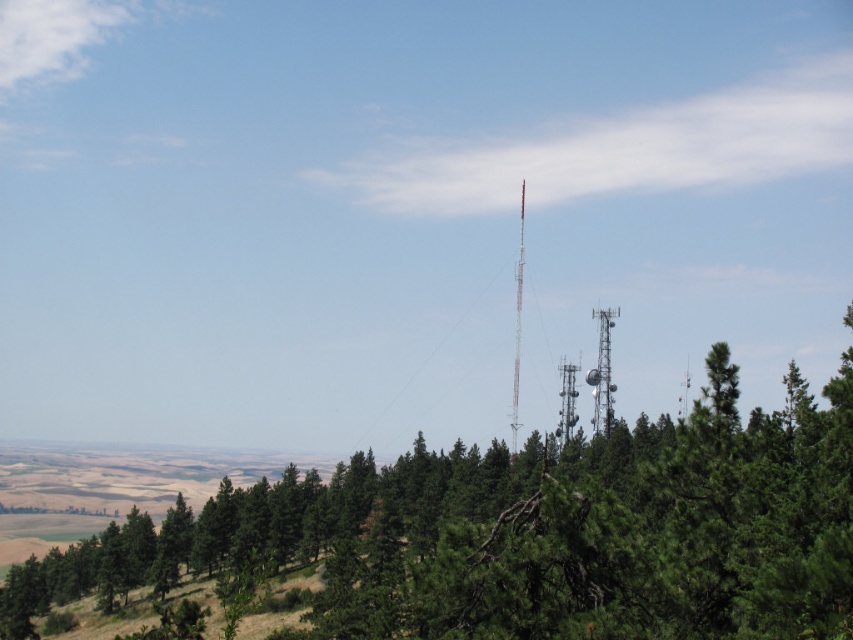
Question: Among these points, which one is nearest to the camera?

Choices:
 (A) (567, 416)
 (B) (518, 268)
 (C) (849, 364)

Answer: (C)

Question: Does silver metallic tower at center-right appear on the left side of metallic gray tower at center-right?

Choices:
 (A) no
 (B) yes

Answer: (A)

Question: Which object is the farthest from the metallic gray tower at center-right?

Choices:
 (A) silver metallic tower at center-right
 (B) metallic tower at center

Answer: (B)

Question: Which of the following is the closest to the observer?

Choices:
 (A) (514, 401)
 (B) (749, 595)
 (C) (566, 390)

Answer: (B)

Question: Is metallic tower at center above metallic gray tower at center-right?

Choices:
 (A) no
 (B) yes

Answer: (B)

Question: Is the position of green textured tree at center less distant than that of metallic tower at center?

Choices:
 (A) no
 (B) yes

Answer: (B)